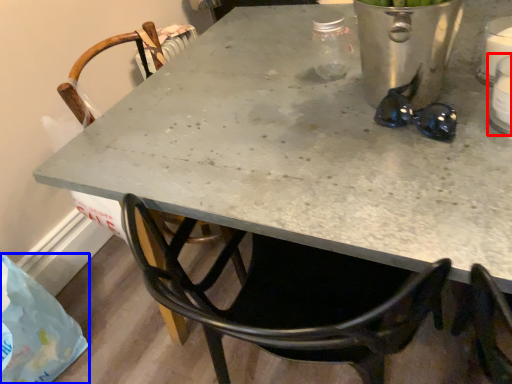
Question: Which of the following is the closest to the observer, appliance (highlighted by a red box) or plastic bag (highlighted by a blue box)?

Choices:
 (A) appliance
 (B) plastic bag

Answer: (A)